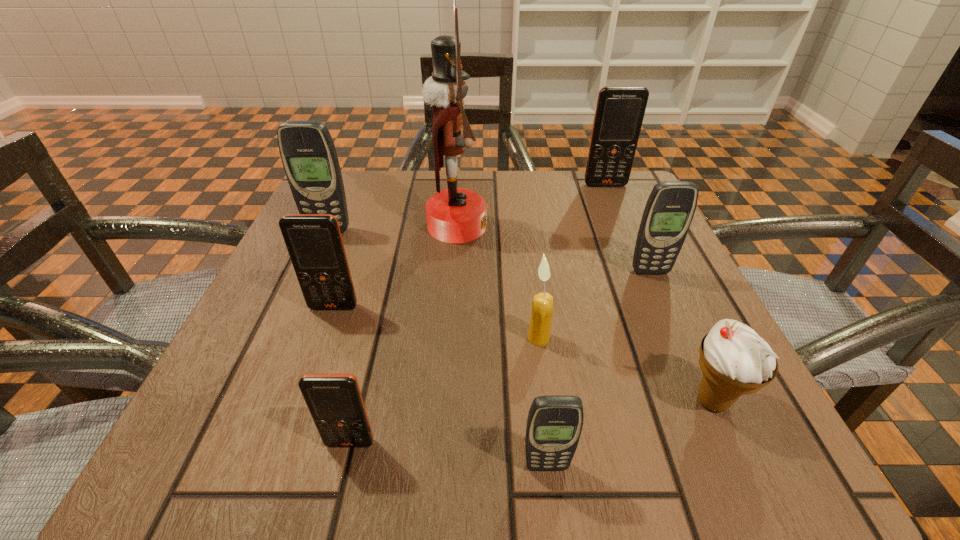
Where is `the tallest object`? The width and height of the screenshot is (960, 540). the tallest object is located at coordinates (455, 215).

Where is `nutcracker`? Image resolution: width=960 pixels, height=540 pixels. nutcracker is located at coordinates (455, 215).

Where is `the farthest object`? the farthest object is located at coordinates (620, 110).

You are a GUI agent. You are given a task and a screenshot of the screen. Output one action in this format:
    pyautogui.click(x=<x>, y=<y>)
    Task: Click on the rightmost orange cellular telephone
    
    Given the screenshot: What is the action you would take?
    pyautogui.click(x=620, y=110)

Find the location of `the leftmost gray cellular telephone`. the leftmost gray cellular telephone is located at coordinates (308, 154).

Identify the location of the farthest gray cellular telephone. The height and width of the screenshot is (540, 960). (308, 154).

Locate an element on the screen. the fourth nearest cellular telephone is located at coordinates (670, 208).

Image resolution: width=960 pixels, height=540 pixels. What are the coordinates of `the sixth nearest object` in the screenshot? It's located at (670, 208).

You are a GUI agent. You are given a task and a screenshot of the screen. Output one action in this format:
    pyautogui.click(x=<x>, y=<y>)
    Task: Click on the fifth farthest object
    
    Given the screenshot: What is the action you would take?
    pos(314,242)

Find the location of a particular element. The image size is (960, 540). the second smallest orange cellular telephone is located at coordinates (314, 242).